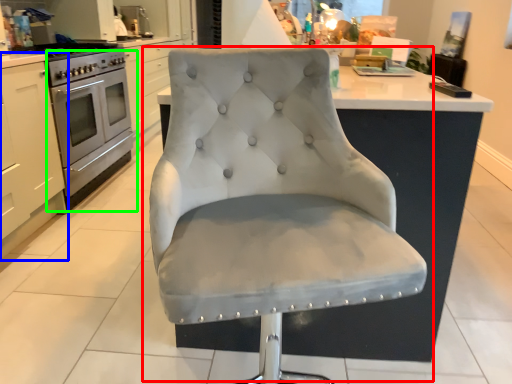
Question: Estimate the real-world distances between objects in this image. Which object is closer to chair (highlighted by a red box), cabinetry (highlighted by a blue box) or oven (highlighted by a green box)?

Choices:
 (A) cabinetry
 (B) oven

Answer: (A)